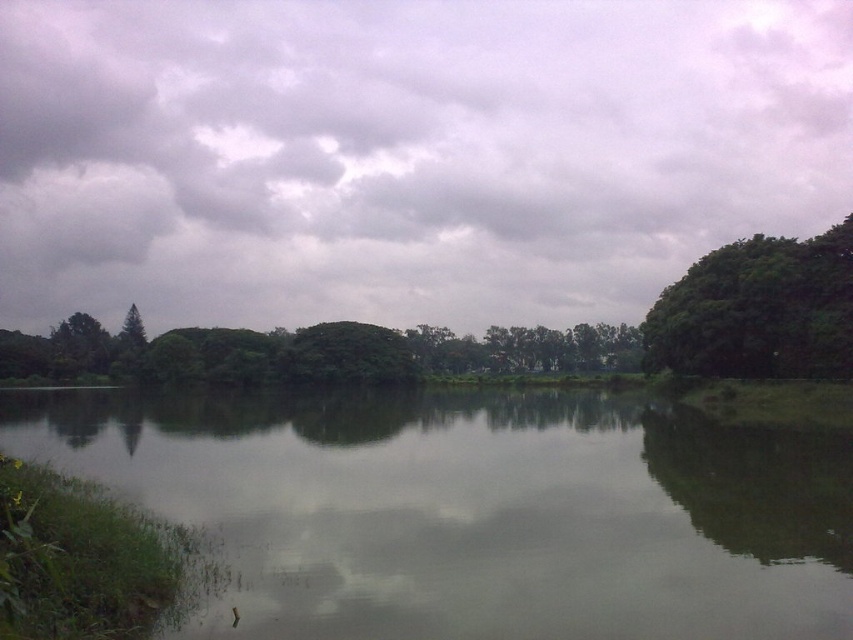
Question: Which of the following is the farthest from the observer?

Choices:
 (A) (735, 164)
 (B) (676, 353)

Answer: (A)

Question: Observing the image, what is the correct spatial positioning of green leafy trees at center in reference to green leafy tree at right?

Choices:
 (A) above
 (B) below

Answer: (B)

Question: Is cloudy sky at upper center above green reflective water at center?

Choices:
 (A) no
 (B) yes

Answer: (B)

Question: Is green reflective water at center positioned at the back of green leafy tree at right?

Choices:
 (A) no
 (B) yes

Answer: (A)

Question: Which point appears closest to the camera in this image?

Choices:
 (A) (6, 337)
 (B) (700, 488)
 (C) (761, 298)
 (D) (561, 32)

Answer: (B)

Question: Which is nearer to the green reflective water at center?

Choices:
 (A) green leafy trees at center
 (B) cloudy sky at upper center

Answer: (A)